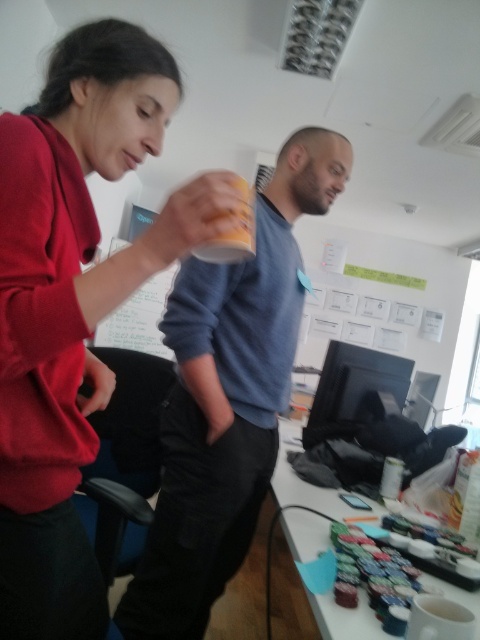
You are an office assistant who needs to place a new document on the white glossy table at lower right without disturbing the existing items. Considering the position of the matte red sweater at upper left, can you do this task?

The matte red sweater at upper left is located above the white glossy table at lower right, which means the table is below the sweater. Since you are an office assistant, you can reach down to place the document on the table without disturbing the items above or around it.

You are standing in the office scene and need to determine which object is taller between the matte red sweater at upper left and the white glossy table at lower right. Based on the scene, which one is taller?

The matte red sweater at upper left is taller than the white glossy table at lower right.

You are standing at the point marked as point [343,506] in the image. You want to walk to the door located behind the desk. The door is 3 feet away from you. Can you reach the door without moving past the desk?

The distance between you and the viewer is 4.39 feet, which is greater than the 3 feet distance to the door. Therefore, you can reach the door without moving past the desk.